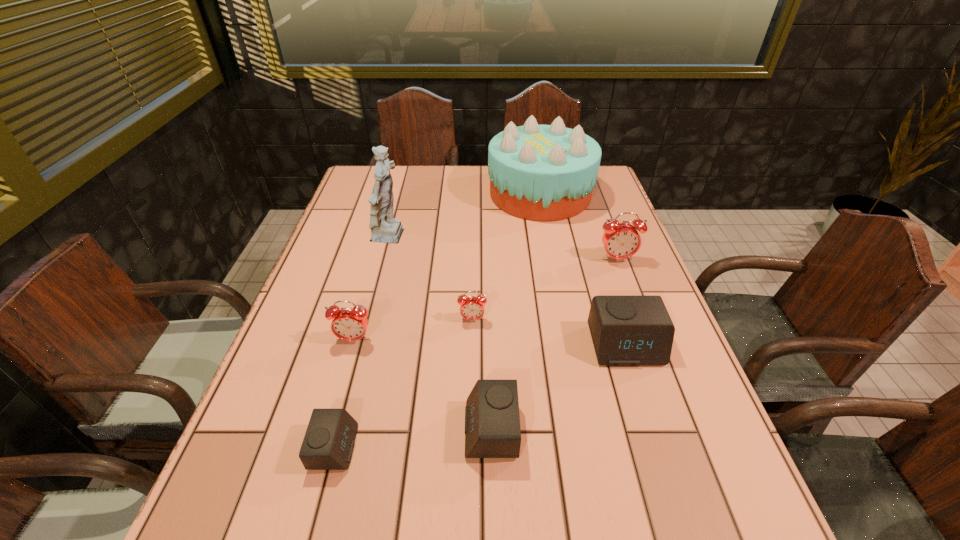
You are a GUI agent. You are given a task and a screenshot of the screen. Output one action in this format:
    pyautogui.click(x=<x>, y=<y>)
    Task: Click on the figurine
    This screenshot has height=540, width=960.
    Given the screenshot: What is the action you would take?
    click(x=386, y=229)

This screenshot has width=960, height=540. Identify the location of the seventh nearest object. (386, 229).

Image resolution: width=960 pixels, height=540 pixels. In order to click on cake in this screenshot , I will do `click(537, 172)`.

Locate an element on the screen. The image size is (960, 540). the farthest object is located at coordinates (537, 172).

The height and width of the screenshot is (540, 960). I want to click on the farthest alarm clock, so click(x=621, y=240).

Where is `the sixth nearest object`? the sixth nearest object is located at coordinates (621, 240).

This screenshot has height=540, width=960. I want to click on the leftmost red alarm clock, so click(x=348, y=324).

Image resolution: width=960 pixels, height=540 pixels. What are the coordinates of `the second biggest red alarm clock` in the screenshot? It's located at (348, 324).

This screenshot has width=960, height=540. In order to click on the farthest black alarm clock in this screenshot , I will do `click(626, 330)`.

Locate an element on the screen. the rightmost black alarm clock is located at coordinates (626, 330).